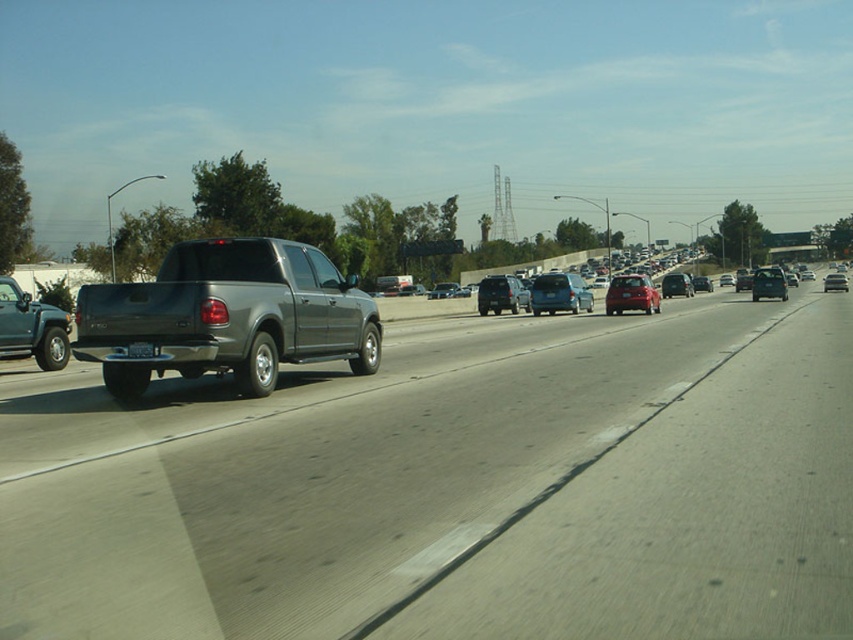
You are a driver trying to parallel park your car between two sedans in the image. The two sedans are the matte blue sedan at center and the metallic silver sedan at center. Which one of these two sedans is shorter in height and therefore might allow easier clearance under a low bridge ahead?

The matte blue sedan at center has a lesser height compared to the metallic silver sedan at center, so it is shorter and would provide easier clearance under a low bridge.

You are a driver in the dark colored pickup truck and you want to check your license plate. Which direction should you look to see the black plastic license plate at rear from the satin black suv at center?

Since the satin black suv at center is to the right of the black plastic license plate at rear, you should look to the left from the satin black suv at center to see the black plastic license plate at rear.

You are a driver approaching the intersection ahead. You see a shiny red sedan at center and a metallic silver sedan at center. Which vehicle is positioned to the left side of the other?

The shiny red sedan at center is to the left of metallic silver sedan at center.